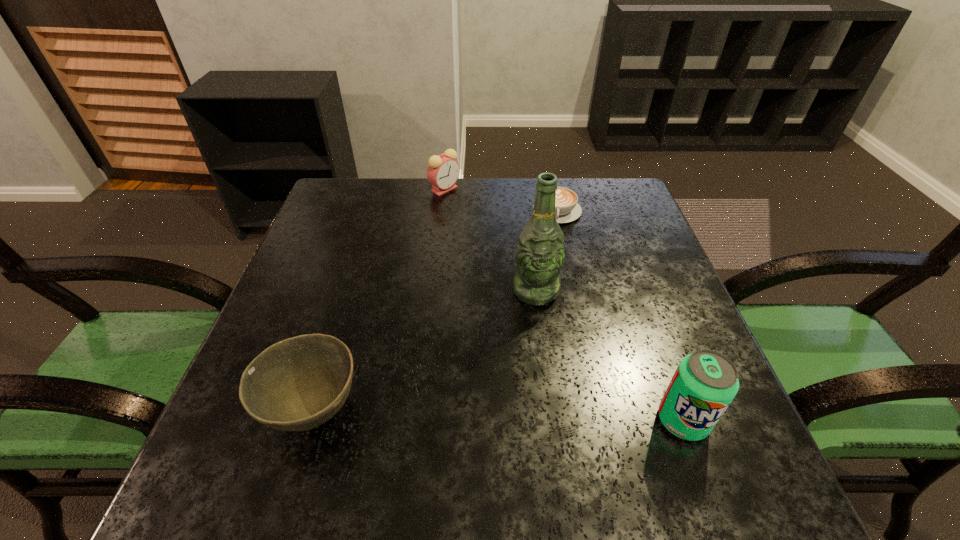
Locate an element on the screen. the leftmost object is located at coordinates (297, 384).

The width and height of the screenshot is (960, 540). Find the location of `the rightmost object`. the rightmost object is located at coordinates (705, 382).

The width and height of the screenshot is (960, 540). In order to click on the second tallest object in this screenshot , I will do `click(705, 382)`.

This screenshot has width=960, height=540. What are the coordinates of `cappuccino` in the screenshot? It's located at pos(567,209).

The image size is (960, 540). In order to click on the second farthest object in this screenshot , I will do [x=567, y=209].

Locate an element on the screen. Image resolution: width=960 pixels, height=540 pixels. the farthest object is located at coordinates (443, 171).

Where is `alarm clock`? alarm clock is located at coordinates (443, 171).

Where is `the tallest object`? the tallest object is located at coordinates (540, 253).

Identify the location of beer bottle. Image resolution: width=960 pixels, height=540 pixels. tap(540, 253).

Where is `vacant space situated on the back of the bowl`? The width and height of the screenshot is (960, 540). vacant space situated on the back of the bowl is located at coordinates (359, 263).